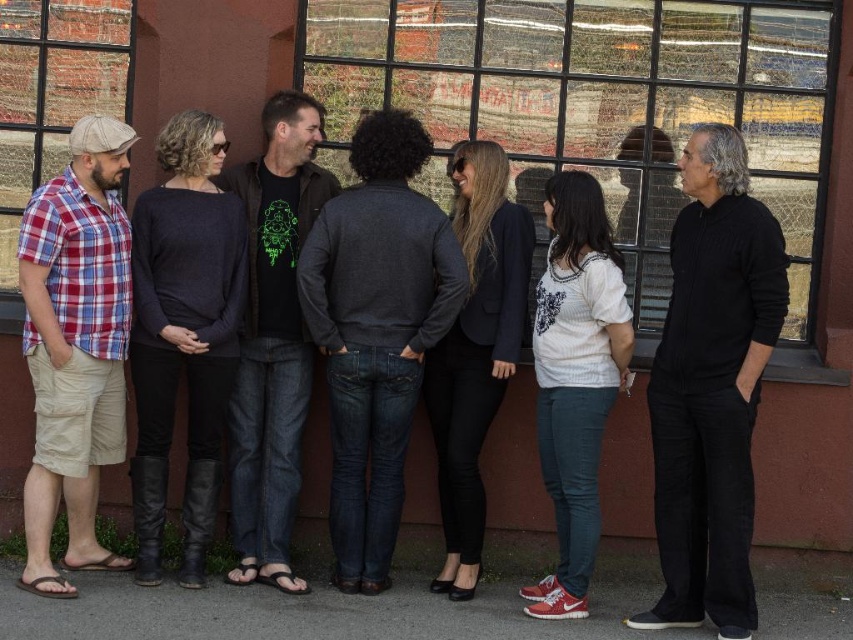
You are a painter who needs to place a 6.5 feet ladder between the glass window at center and the matte glass window at left. Can the ladder fit between them without touching either window?

The distance between the glass window at center and the matte glass window at left is 6.84 feet. Since the ladder is 6.5 feet long, it can fit between them with a small gap of 0.34 feet remaining.

You are analyzing a group photo and need to determine the position of the plaid cotton shirt at left. What are its coordinates?

The plaid cotton shirt at left is located at coordinates (74, 346).